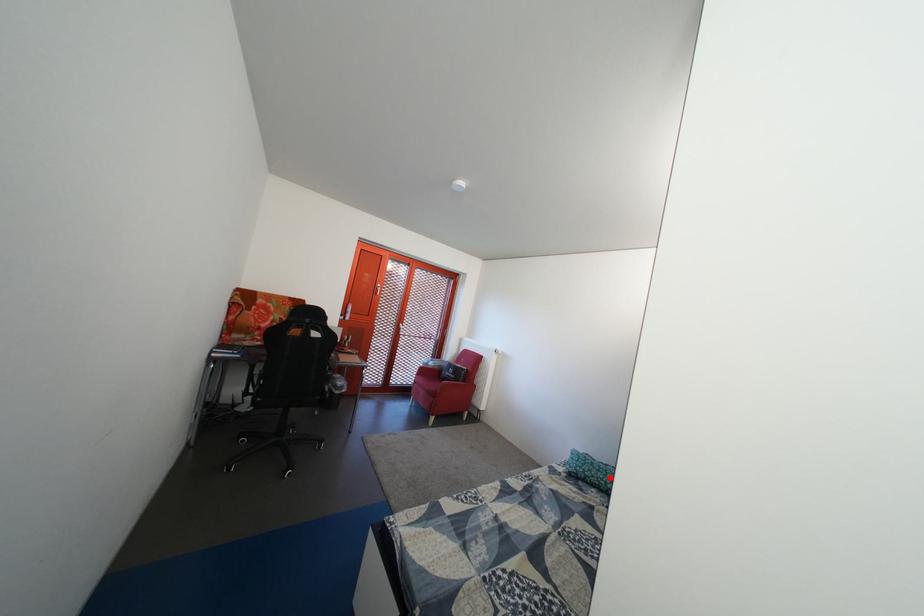
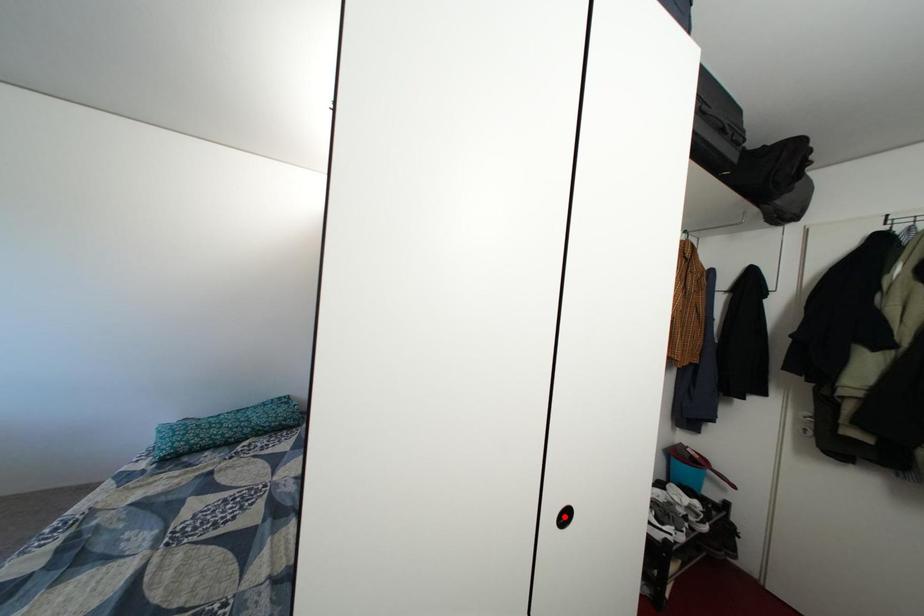
I am providing you with two images of the same scene from different viewpoints. A red point is marked on the first image and another point is marked on the second image. Are the points marked in image1 and image2 representing the same 3D position?

No